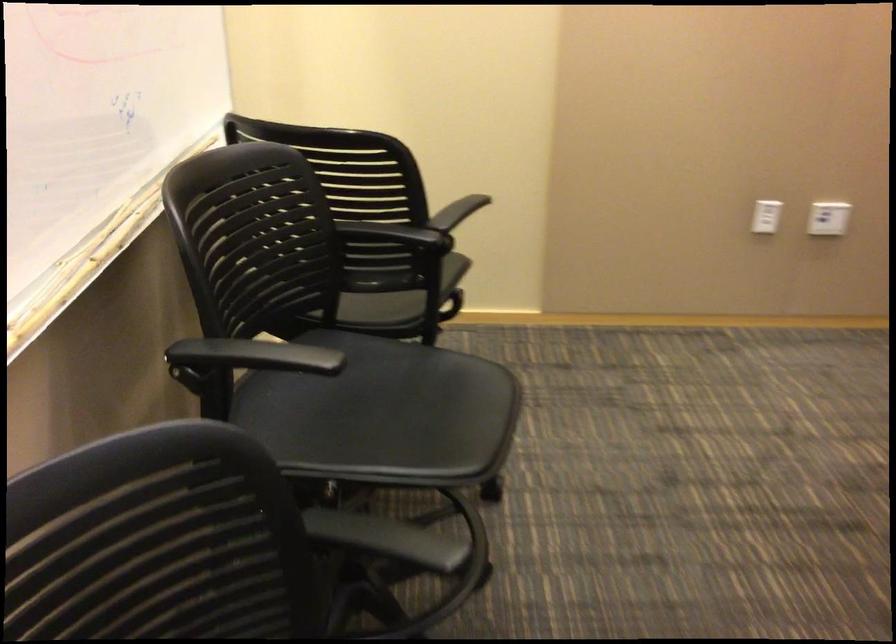
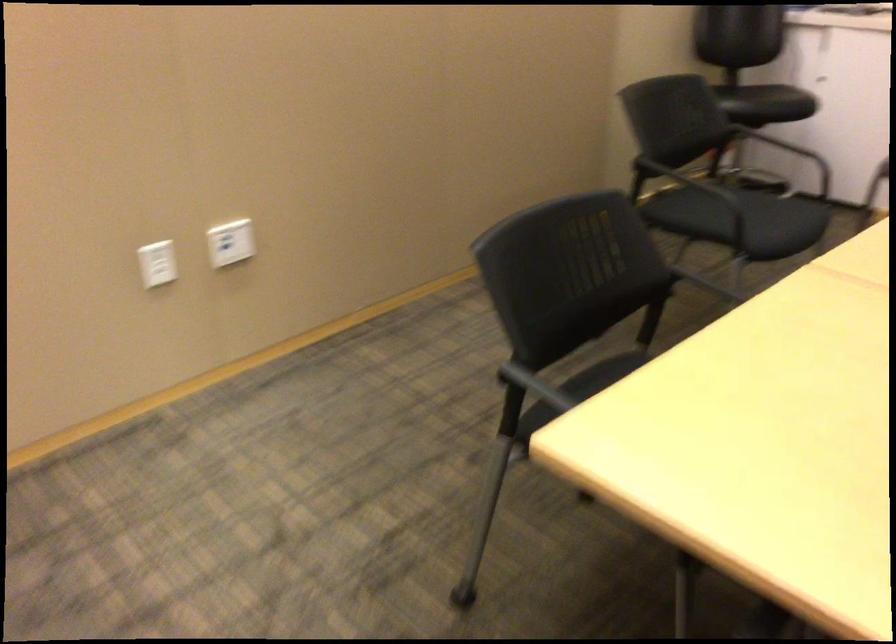
Question: How did the camera likely rotate?

Choices:
 (A) Left
 (B) Right
 (C) Up
 (D) Down

Answer: (B)